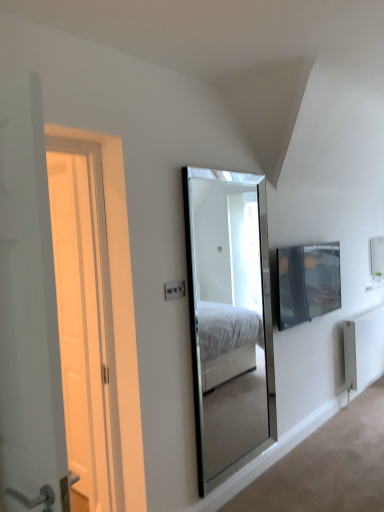
Question: From a real-world perspective, relative to clear glass mirror at center, is white metallic radiator at lower right vertically above or below?

Choices:
 (A) below
 (B) above

Answer: (A)

Question: Is point pyautogui.click(x=372, y=338) positioned closer to the camera than point pyautogui.click(x=261, y=436)?

Choices:
 (A) closer
 (B) farther

Answer: (B)

Question: Considering the real-world distances, which object is farthest from the white metallic radiator at lower right?

Choices:
 (A) white wooden door at left
 (B) matte black tv at right
 (C) clear glass mirror at center
 (D) white plastic electric outlet at center

Answer: (A)

Question: Which is nearer to the matte black tv at right?

Choices:
 (A) white wooden door at left
 (B) clear glass mirror at center
 (C) white plastic electric outlet at center
 (D) white metallic radiator at lower right

Answer: (D)